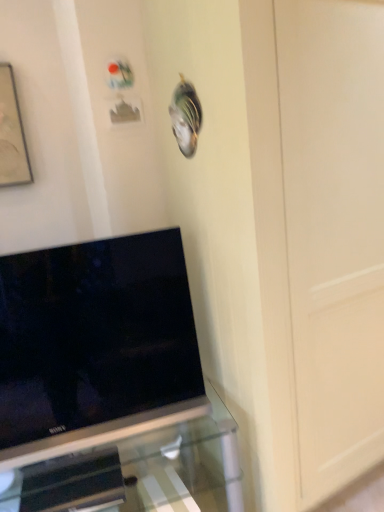
Image resolution: width=384 pixels, height=512 pixels. What do you see at coordinates (12, 134) in the screenshot?
I see `matte black picture frame at upper left` at bounding box center [12, 134].

What do you see at coordinates (95, 345) in the screenshot? The width and height of the screenshot is (384, 512). I see `black glossy tv at lower left` at bounding box center [95, 345].

Find the location of a particular element. The height and width of the screenshot is (512, 384). matte black picture frame at upper left is located at coordinates (12, 134).

Is black glossy tv at lower left completely or partially inside matte black picture frame at upper left?

No, black glossy tv at lower left is not a part of matte black picture frame at upper left.

Are matte black picture frame at upper left and black glossy tv at lower left located far from each other?

No, there isn't a large distance between matte black picture frame at upper left and black glossy tv at lower left.

Who is taller, matte black picture frame at upper left or black glossy tv at lower left?

black glossy tv at lower left.

Considering the sizes of objects matte black picture frame at upper left and black glossy tv at lower left in the image provided, who is wider, matte black picture frame at upper left or black glossy tv at lower left?

With larger width is black glossy tv at lower left.

From the image's perspective, between black glossy tv at lower left and matte black picture frame at upper left, who is located below?

black glossy tv at lower left is shown below in the image.

Does black glossy tv at lower left appear on the right side of matte black picture frame at upper left?

Yes.

Considering the relative sizes of black glossy tv at lower left and matte black picture frame at upper left in the image provided, is black glossy tv at lower left shorter than matte black picture frame at upper left?

No, black glossy tv at lower left is not shorter than matte black picture frame at upper left.

Is black glossy tv at lower left oriented towards matte black picture frame at upper left?

No, black glossy tv at lower left is not facing towards matte black picture frame at upper left.

Is matte black picture frame at upper left at the right side of transparent glass tv stand at lower left?

In fact, matte black picture frame at upper left is to the left of transparent glass tv stand at lower left.

Would you say matte black picture frame at upper left is a long distance from transparent glass tv stand at lower left?

Yes, matte black picture frame at upper left and transparent glass tv stand at lower left are quite far apart.

From the image's perspective, is matte black picture frame at upper left above transparent glass tv stand at lower left?

Yes, from the image's perspective, matte black picture frame at upper left is on top of transparent glass tv stand at lower left.

From their relative heights in the image, would you say matte black picture frame at upper left is taller or shorter than transparent glass tv stand at lower left?

In the image, matte black picture frame at upper left appears to be shorter than transparent glass tv stand at lower left.

How different are the orientations of black glossy tv at lower left and transparent glass tv stand at lower left in degrees?

14.3 degrees.

Can you confirm if black glossy tv at lower left is shorter than transparent glass tv stand at lower left?

Incorrect, the height of black glossy tv at lower left does not fall short of that of transparent glass tv stand at lower left.

Is black glossy tv at lower left next to transparent glass tv stand at lower left and touching it?

black glossy tv at lower left is not next to transparent glass tv stand at lower left, and they're not touching.

From the image's perspective, between black glossy tv at lower left and transparent glass tv stand at lower left, which one is located above?

black glossy tv at lower left.

Are transparent glass tv stand at lower left and matte black picture frame at upper left making contact?

No, transparent glass tv stand at lower left is not in contact with matte black picture frame at upper left.

Which is farther from the camera, (139, 448) or (4, 74)?

The point (139, 448) is farther.

Looking at their sizes, would you say transparent glass tv stand at lower left is wider or thinner than matte black picture frame at upper left?

Considering their sizes, transparent glass tv stand at lower left looks broader than matte black picture frame at upper left.

Could you tell me if transparent glass tv stand at lower left is turned towards matte black picture frame at upper left?

No, transparent glass tv stand at lower left is not turned towards matte black picture frame at upper left.

From the picture: From the image's perspective, which is below, transparent glass tv stand at lower left or black glossy tv at lower left?

From the image's view, transparent glass tv stand at lower left is below.

Would you say transparent glass tv stand at lower left contains black glossy tv at lower left?

No, black glossy tv at lower left is not inside transparent glass tv stand at lower left.

Is transparent glass tv stand at lower left further to camera compared to black glossy tv at lower left?

No, it is in front of black glossy tv at lower left.

Are transparent glass tv stand at lower left and black glossy tv at lower left beside each other?

They are not placed beside each other.

Locate an element on the screen. picture frame that is above the black glossy tv at lower left (from the image's perspective) is located at coordinates (12, 134).

At what (x,y) coordinates should I click in order to perform the action: click on television on the right of matte black picture frame at upper left. Please return your answer as a coordinate pair (x, y). Image resolution: width=384 pixels, height=512 pixels. Looking at the image, I should click on (95, 345).

Considering their positions, is black glossy tv at lower left positioned further to matte black picture frame at upper left than transparent glass tv stand at lower left?

Among the two, transparent glass tv stand at lower left is located further to matte black picture frame at upper left.

Based on their spatial positions, is matte black picture frame at upper left or transparent glass tv stand at lower left further from black glossy tv at lower left?

Based on the image, matte black picture frame at upper left appears to be further to black glossy tv at lower left.

Looking at the image, which one is located further to transparent glass tv stand at lower left, matte black picture frame at upper left or black glossy tv at lower left?

Based on the image, matte black picture frame at upper left appears to be further to transparent glass tv stand at lower left.

Considering their positions, is transparent glass tv stand at lower left positioned further to black glossy tv at lower left than matte black picture frame at upper left?

Among the two, matte black picture frame at upper left is located further to black glossy tv at lower left.

Based on their spatial positions, is transparent glass tv stand at lower left or black glossy tv at lower left closer to matte black picture frame at upper left?

The object closer to matte black picture frame at upper left is black glossy tv at lower left.

When comparing their distances from transparent glass tv stand at lower left, does black glossy tv at lower left or matte black picture frame at upper left seem closer?

Based on the image, black glossy tv at lower left appears to be nearer to transparent glass tv stand at lower left.

Image resolution: width=384 pixels, height=512 pixels. Identify the location of television between matte black picture frame at upper left and transparent glass tv stand at lower left in the up-down direction. (95, 345).